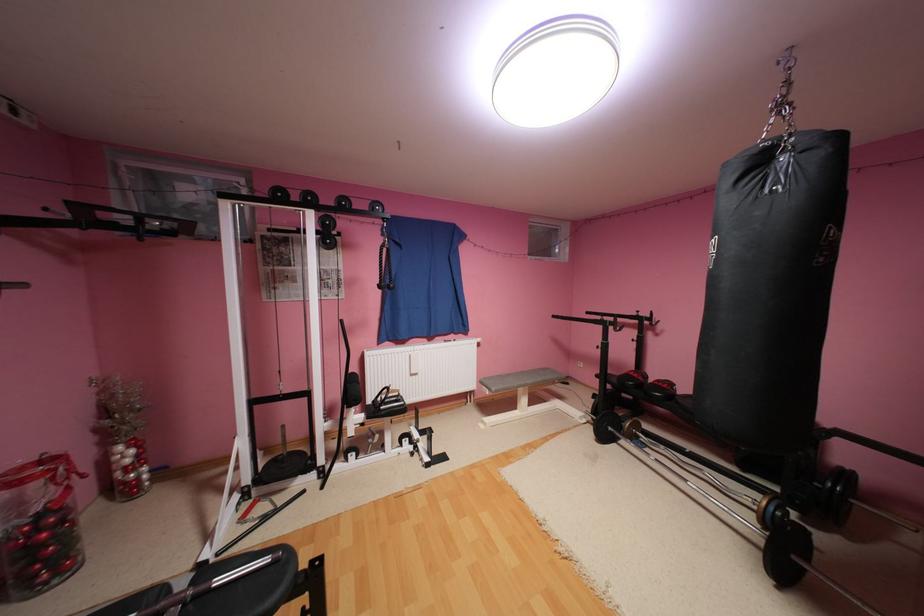
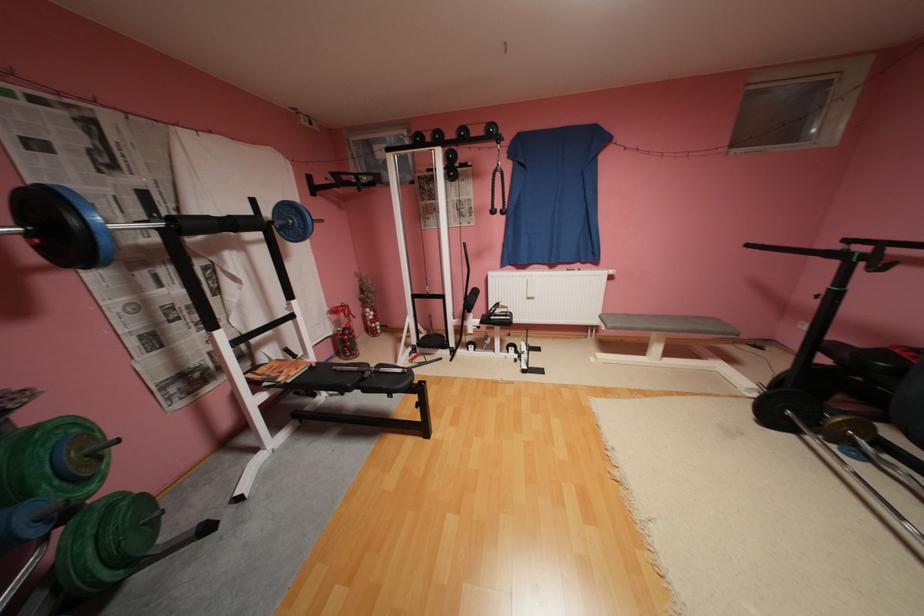
The point at (563,315) is marked in the first image. Where is the corresponding point in the second image?

(757, 246)